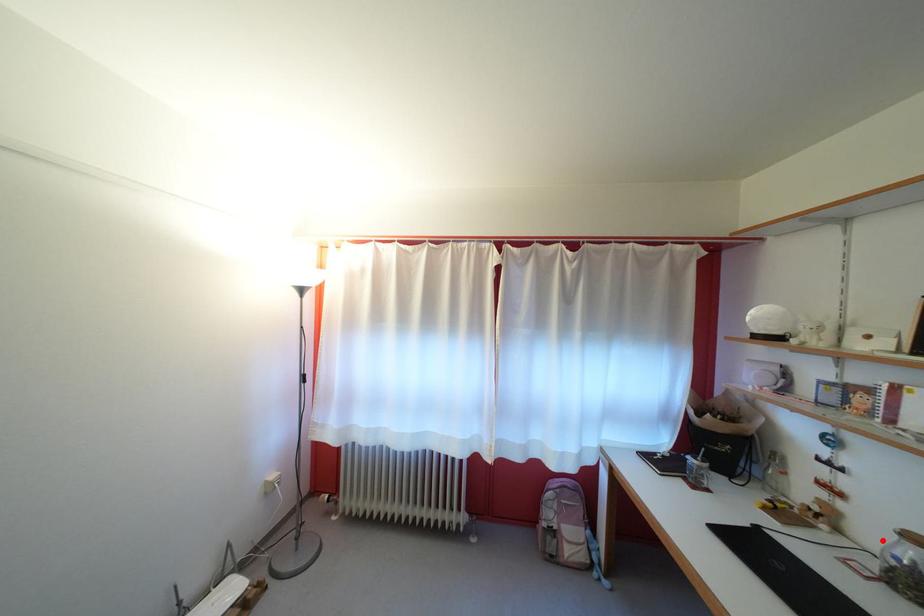
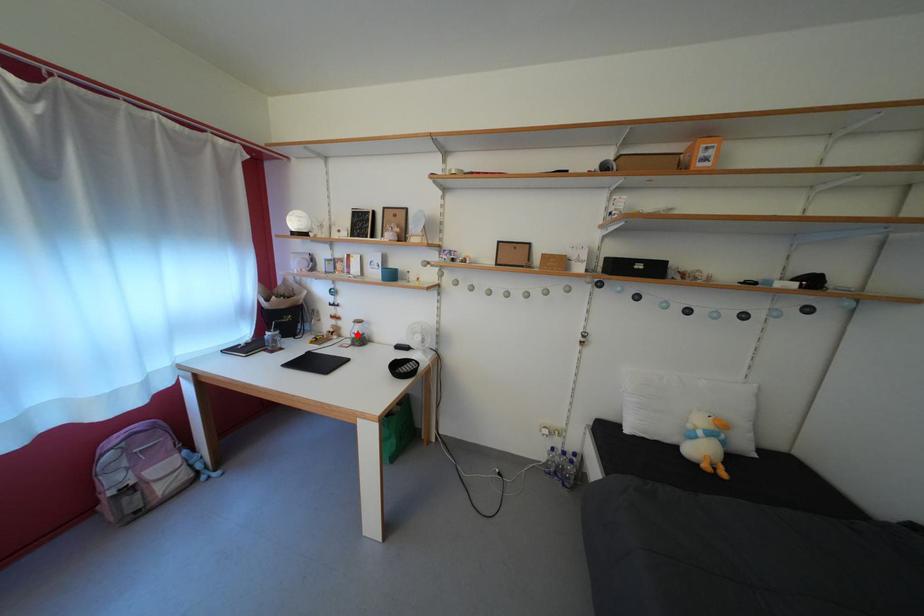
I am providing you with two images of the same scene from different viewpoints. A red point is marked on the first image and another point is marked on the second image. Is the marked point in image1 the same physical position as the marked point in image2?

Yes